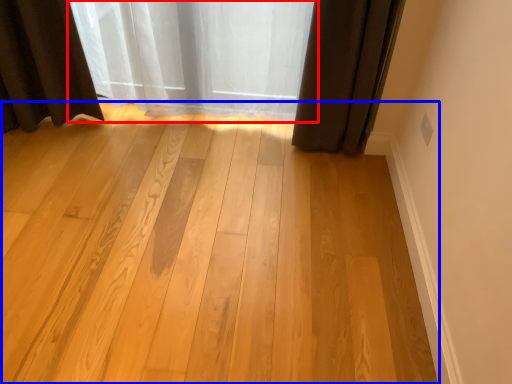
Question: Among these objects, which one is farthest to the camera, curtain (highlighted by a red box) or plank (highlighted by a blue box)?

Choices:
 (A) curtain
 (B) plank

Answer: (A)